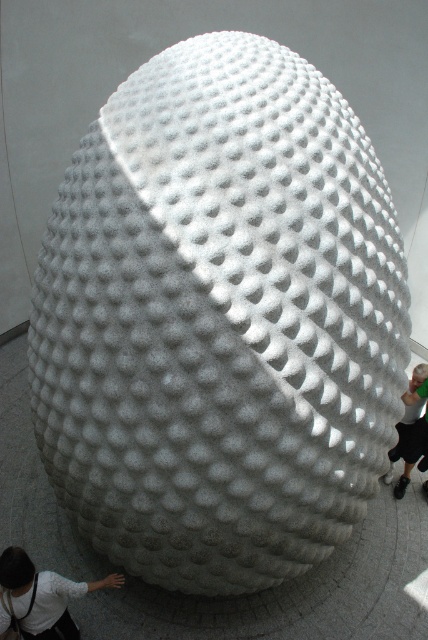
Question: Which point is farther to the camera?

Choices:
 (A) green fabric pants at lower right
 (B) white textured shirt at lower left

Answer: (A)

Question: Which point appears farthest from the camera in this image?

Choices:
 (A) (53, 627)
 (B) (404, 412)

Answer: (B)

Question: Is white textured shirt at lower left to the left of green fabric pants at lower right from the viewer's perspective?

Choices:
 (A) yes
 (B) no

Answer: (A)

Question: Observing the image, what is the correct spatial positioning of white textured shirt at lower left in reference to green fabric pants at lower right?

Choices:
 (A) right
 (B) left

Answer: (B)

Question: Can you confirm if white textured shirt at lower left is positioned above green fabric pants at lower right?

Choices:
 (A) no
 (B) yes

Answer: (A)